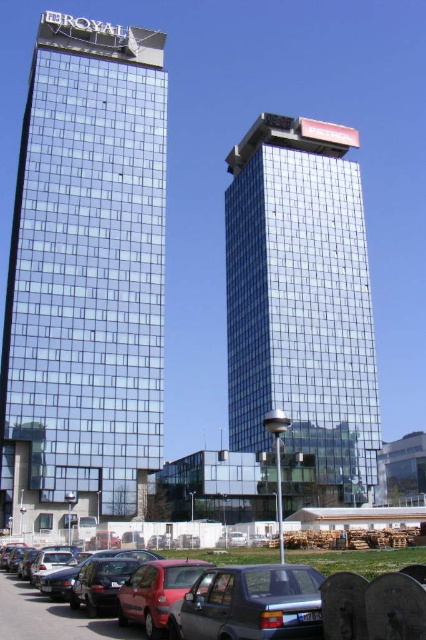
The image size is (426, 640). Describe the element at coordinates (252, 604) in the screenshot. I see `metallic silver sedan at lower center` at that location.

Does metallic silver sedan at lower center have a lesser height compared to red matte car at lower left?

Indeed, metallic silver sedan at lower center has a lesser height compared to red matte car at lower left.

You are a GUI agent. You are given a task and a screenshot of the screen. Output one action in this format:
    pyautogui.click(x=<x>, y=<y>)
    Task: Click on the metallic silver sedan at lower center
    This screenshot has height=640, width=426.
    Given the screenshot: What is the action you would take?
    pyautogui.click(x=252, y=604)

Does shiny glass building at left have a greater width compared to metallic silver car at lower center?

Indeed, shiny glass building at left has a greater width compared to metallic silver car at lower center.

Between shiny glass building at left and metallic silver car at lower center, which one has less height?

metallic silver car at lower center

This screenshot has height=640, width=426. In order to click on shiny glass building at left in this screenshot , I will do `click(86, 280)`.

Find the location of a particular element. The image size is (426, 640). shiny glass building at left is located at coordinates (86, 280).

What do you see at coordinates (49, 616) in the screenshot? This screenshot has height=640, width=426. I see `metallic silver car at lower center` at bounding box center [49, 616].

Find the location of a particular element. metallic silver car at lower center is located at coordinates (49, 616).

Image resolution: width=426 pixels, height=640 pixels. What are the coordinates of `metallic silver car at lower center` in the screenshot? It's located at (49, 616).